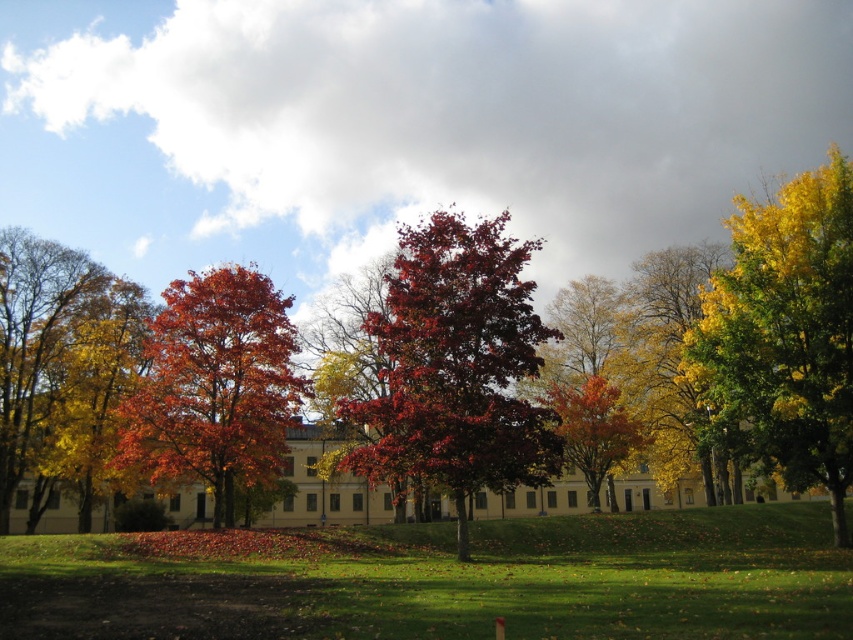
Question: Which point is farther to the camera?

Choices:
 (A) (x=149, y=435)
 (B) (x=703, y=298)

Answer: (B)

Question: Is shiny red leaves at center to the right of shiny crimson leaves at center from the viewer's perspective?

Choices:
 (A) no
 (B) yes

Answer: (B)

Question: In this image, where is shiny red leaves at center located relative to shiny crimson leaves at center?

Choices:
 (A) left
 (B) right

Answer: (B)

Question: Which object is the closest to the yellow-green leafy tree at right?

Choices:
 (A) shiny red maple tree at center
 (B) shiny crimson leaves at center
 (C) shiny red leaves at center

Answer: (C)

Question: From the image, what is the correct spatial relationship of yellow-green leafy tree at right in relation to shiny red maple tree at center?

Choices:
 (A) right
 (B) left

Answer: (A)

Question: Which object is positioned farthest from the shiny red leaves at center?

Choices:
 (A) shiny crimson leaves at center
 (B) yellow-green leafy tree at right

Answer: (A)